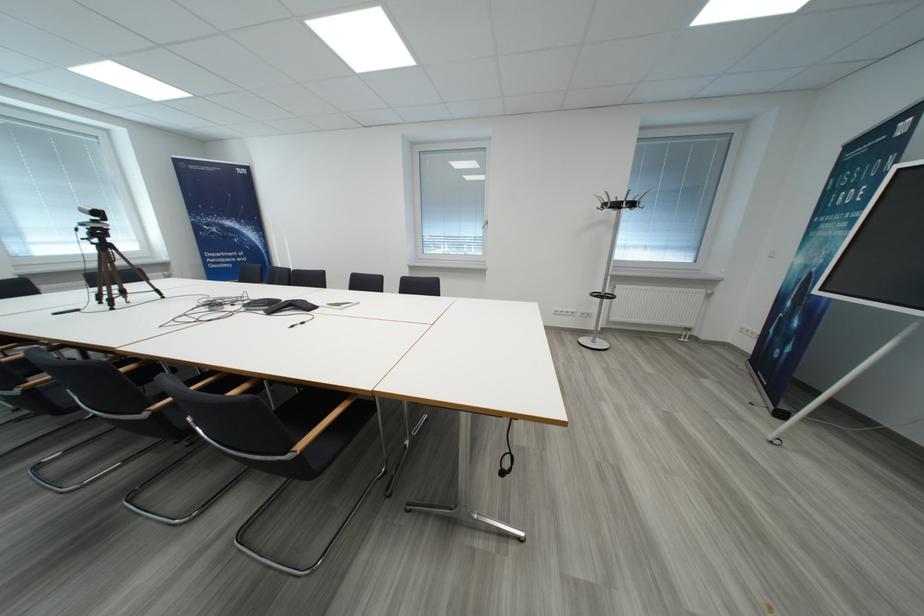
Locate an element on the screen. This screenshot has width=924, height=616. web camera is located at coordinates (93, 224).